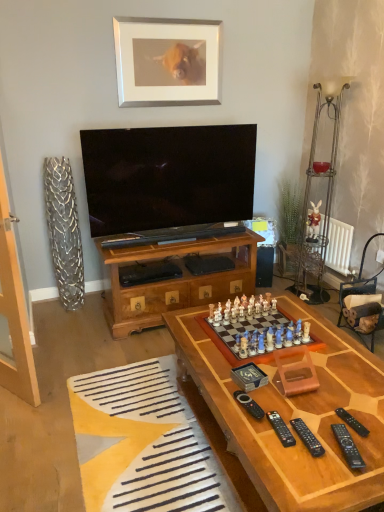
Image resolution: width=384 pixels, height=512 pixels. Identify the location of free area in between black plastic remote at lower right, the fourth remote when ordered from left to right, and black plastic remote at center, which appears as the first remote when viewed from the left. (296, 426).